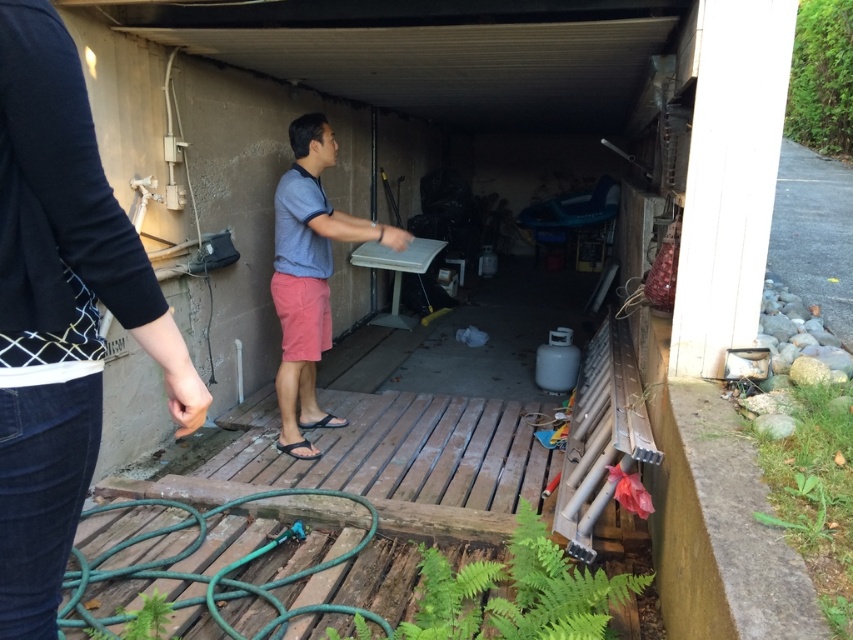
Can you confirm if black cotton shirt at upper left is taller than gray cotton shirt at center?

No, black cotton shirt at upper left is not taller than gray cotton shirt at center.

Can you confirm if black cotton shirt at upper left is thinner than gray cotton shirt at center?

Indeed, black cotton shirt at upper left has a lesser width compared to gray cotton shirt at center.

At what (x,y) coordinates should I click in order to perform the action: click on black cotton shirt at upper left. Please return your answer as a coordinate pair (x, y). Looking at the image, I should click on (59, 310).